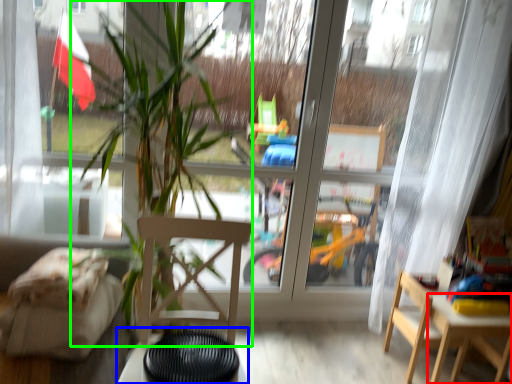
Question: Considering the real-world distances, which object is farthest from table (highlighted by a red box)? table (highlighted by a blue box) or houseplant (highlighted by a green box)?

Choices:
 (A) table
 (B) houseplant

Answer: (A)